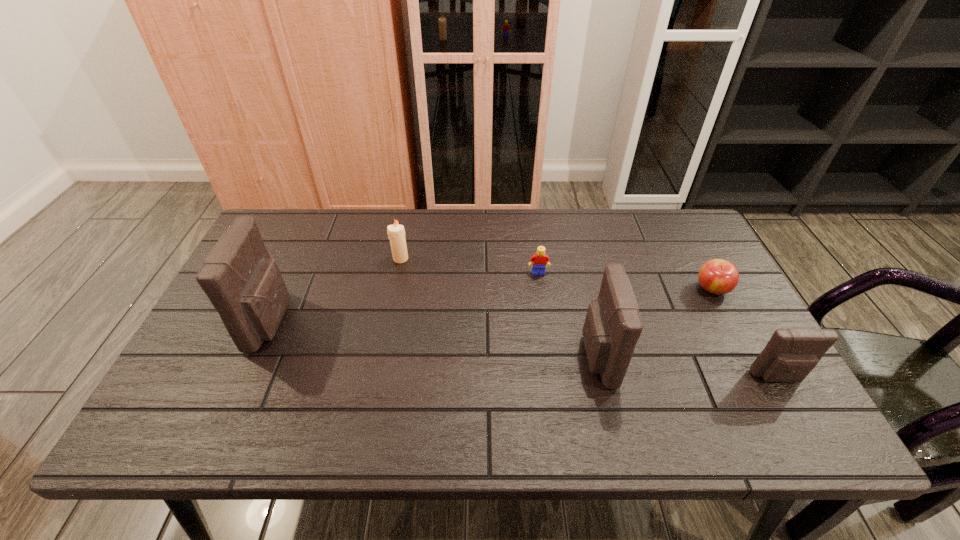
Where is `vacant space that's between the fourth object from right to left and the shortest pouch`? The height and width of the screenshot is (540, 960). vacant space that's between the fourth object from right to left and the shortest pouch is located at coordinates (659, 325).

The image size is (960, 540). I want to click on free space between the leftmost object and the fourth object from left to right, so click(x=435, y=339).

Find the location of a particular element. The width and height of the screenshot is (960, 540). free area in between the rightmost pouch and the apple is located at coordinates (745, 333).

Find the location of a particular element. The height and width of the screenshot is (540, 960). vacant area that lies between the shortest pouch and the apple is located at coordinates (745, 333).

Find the location of a particular element. empty location between the fifth object from right to left and the leftmost pouch is located at coordinates (336, 290).

Identify the location of vacant space that's between the fifth object from right to left and the second pouch from right to left. (498, 308).

This screenshot has height=540, width=960. Identify the location of object that stands as the second closest to the shortest pouch. (612, 327).

Locate an element on the screen. The width and height of the screenshot is (960, 540). object identified as the fifth closest to the fifth shortest object is located at coordinates (245, 286).

What are the coordinates of `pouch object that ranks as the second closest to the rightmost pouch` in the screenshot? It's located at click(245, 286).

Point out which pouch is positioned as the nearest to the shortest pouch. Please provide its 2D coordinates. Your answer should be formatted as a tuple, i.e. [(x, y)], where the tuple contains the x and y coordinates of a point satisfying the conditions above.

[(612, 327)]